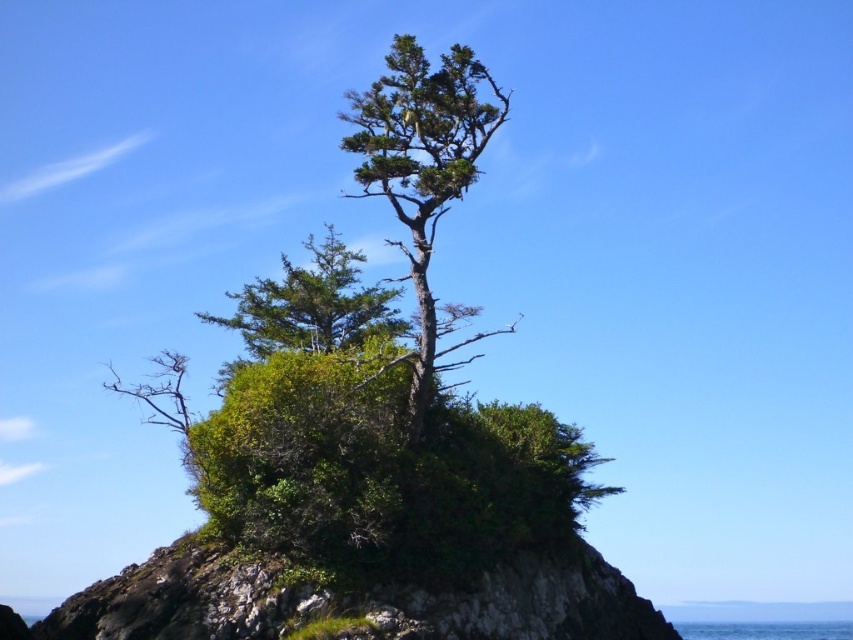
Find the location of a particular element. This screenshot has height=640, width=853. green textured tree at center is located at coordinates point(422,173).

Who is positioned more to the left, green textured tree at center or blue liquid water at lower center?

Positioned to the left is green textured tree at center.

Image resolution: width=853 pixels, height=640 pixels. What are the coordinates of `green textured tree at center` in the screenshot? It's located at point(422,173).